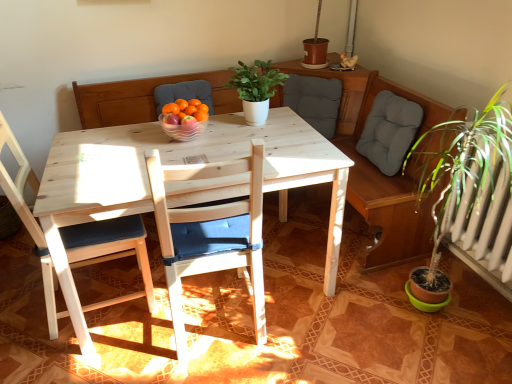
Question: Is clear glass bowl at center aimed at wooden chair with blue cushion at left, which is counted as the 2th chair, starting from the right?

Choices:
 (A) yes
 (B) no

Answer: (B)

Question: Considering the relative positions of clear glass bowl at center and wooden chair with blue cushion at left, which is the 1th chair from left to right, in the image provided, is clear glass bowl at center behind wooden chair with blue cushion at left, which is the 1th chair from left to right,?

Choices:
 (A) yes
 (B) no

Answer: (A)

Question: Considering the relative positions of clear glass bowl at center and wooden chair with blue cushion at left, which is counted as the 2th chair, starting from the right, in the image provided, is clear glass bowl at center in front of wooden chair with blue cushion at left, which is counted as the 2th chair, starting from the right,?

Choices:
 (A) yes
 (B) no

Answer: (B)

Question: From a real-world perspective, is clear glass bowl at center located beneath wooden chair with blue cushion at left, which is the 1th chair from left to right?

Choices:
 (A) no
 (B) yes

Answer: (A)

Question: Is clear glass bowl at center located outside wooden chair with blue cushion at left, which is the 1th chair from left to right?

Choices:
 (A) yes
 (B) no

Answer: (A)

Question: Do you think wooden chair with blue cushion at center, the second chair from the left, is within wooden chair with blue cushion at left, which is counted as the 2th chair, starting from the right, or outside of it?

Choices:
 (A) inside
 (B) outside

Answer: (B)

Question: Does point pos(205,248) appear closer or farther from the camera than point pos(19,163)?

Choices:
 (A) farther
 (B) closer

Answer: (B)

Question: From the image's perspective, is wooden chair with blue cushion at center, the second chair from the left, positioned above or below wooden chair with blue cushion at left, which is the 1th chair from left to right?

Choices:
 (A) below
 (B) above

Answer: (A)

Question: In terms of size, does wooden chair with blue cushion at center, which is the 1th chair from right to left, appear bigger or smaller than wooden chair with blue cushion at left, which is counted as the 2th chair, starting from the right?

Choices:
 (A) big
 (B) small

Answer: (A)

Question: From the image's perspective, is gray fabric cushion at upper center positioned above or below clear glass bowl at center?

Choices:
 (A) below
 (B) above

Answer: (B)

Question: In the image, is gray fabric cushion at upper center on the left side or the right side of clear glass bowl at center?

Choices:
 (A) left
 (B) right

Answer: (B)

Question: Is gray fabric cushion at upper center bigger or smaller than clear glass bowl at center?

Choices:
 (A) big
 (B) small

Answer: (A)

Question: In the image, is gray fabric cushion at upper center positioned in front of or behind clear glass bowl at center?

Choices:
 (A) behind
 (B) front

Answer: (A)

Question: Is wooden chair with blue cushion at center, the second chair from the left, bigger or smaller than gray fabric cushion at upper center?

Choices:
 (A) small
 (B) big

Answer: (B)

Question: Is wooden chair with blue cushion at center, which is the 1th chair from right to left, in front of or behind gray fabric cushion at upper center in the image?

Choices:
 (A) front
 (B) behind

Answer: (A)